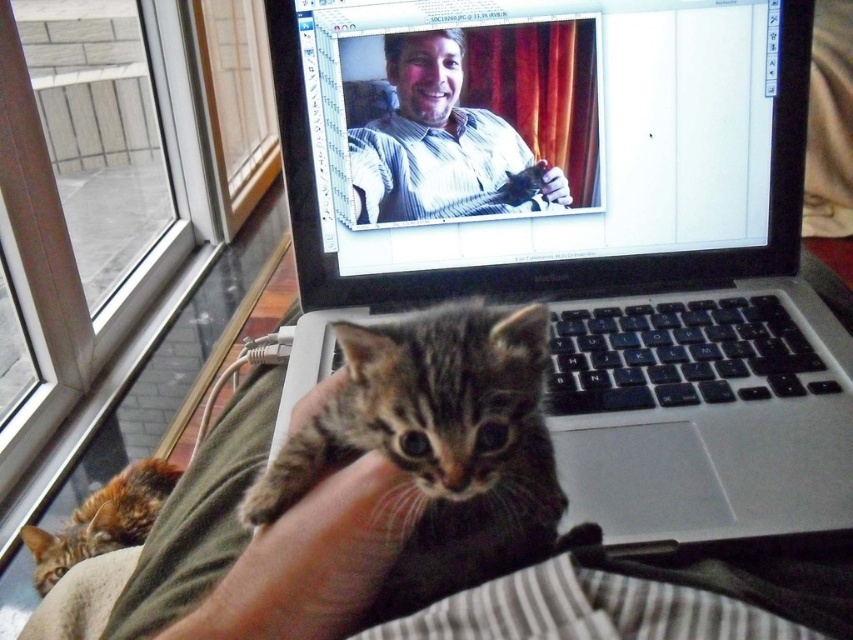
You are a photographer who wants to capture the tabby fur kitten at center and the matte striped shirt at center in the same frame. Based on their positions, which one is closer to the left side of the camera view?

The tabby fur kitten at center is to the left of the matte striped shirt at center, so it is closer to the left side of the camera view.

You are a photographer setting up a shot of the scene described. You want to ensure the tabby fur kitten at center and the matte striped shirt at center are both clearly visible. Given their positions, which object should you focus on first to ensure both are in focus?

The tabby fur kitten at center is in front of the matte striped shirt at center, so focusing on the kitten first will ensure both are in focus since the shirt is behind it.